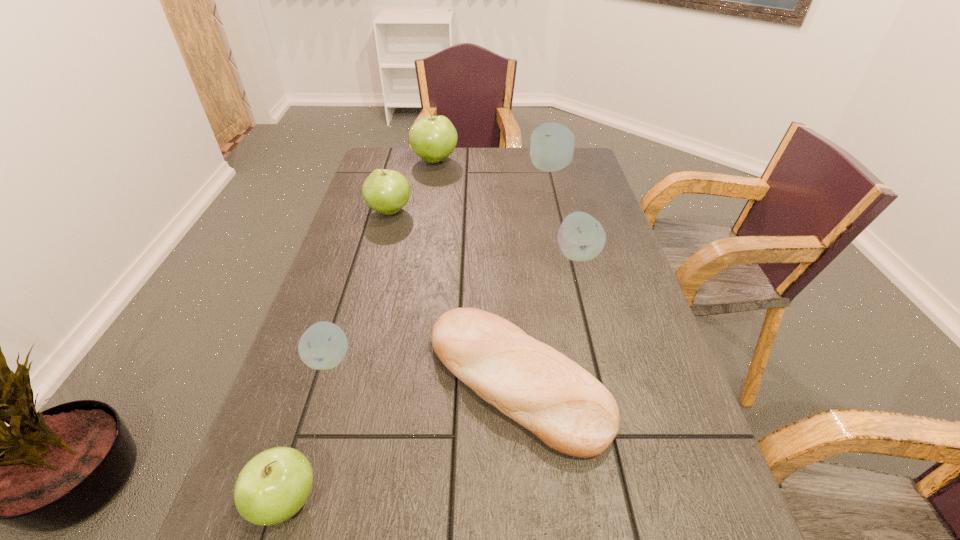
You are a GUI agent. You are given a task and a screenshot of the screen. Output one action in this format:
    pyautogui.click(x=<x>, y=<y>)
    Task: Click on the leftmost white apple
    
    Given the screenshot: What is the action you would take?
    pyautogui.click(x=323, y=346)

Locate an element on the screen. Image resolution: width=960 pixels, height=540 pixels. the nearest white apple is located at coordinates (323, 346).

Locate an element on the screen. This screenshot has width=960, height=540. vacant region located 0.200m on the front of the biggest green apple is located at coordinates (428, 205).

What are the coordinates of `vacant space located 0.270m on the left of the farthest white apple` in the screenshot? It's located at (448, 168).

This screenshot has height=540, width=960. I want to click on vacant position located on the right of the second smallest green apple, so click(482, 211).

The image size is (960, 540). What are the coordinates of `vacant space situated 0.050m on the front of the fourth farthest object` in the screenshot? It's located at (585, 282).

Identify the location of free location located 0.400m on the back of the nearest object. This screenshot has height=540, width=960. (349, 296).

Find the location of `vacant area situated 0.120m on the right of the bread`. vacant area situated 0.120m on the right of the bread is located at coordinates (669, 381).

The width and height of the screenshot is (960, 540). In order to click on blank space located on the front of the shortest apple in this screenshot , I will do `click(275, 535)`.

Where is `bread situated at the right edge`? The image size is (960, 540). bread situated at the right edge is located at coordinates (552, 396).